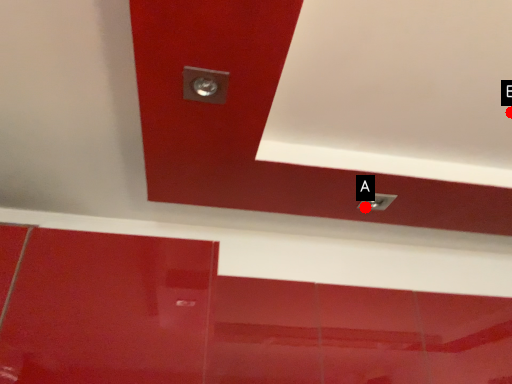
Question: Two points are circled on the image, labeled by A and B beside each circle. Which of the following is the closest to the observer?

Choices:
 (A) A is closer
 (B) B is closer

Answer: (B)